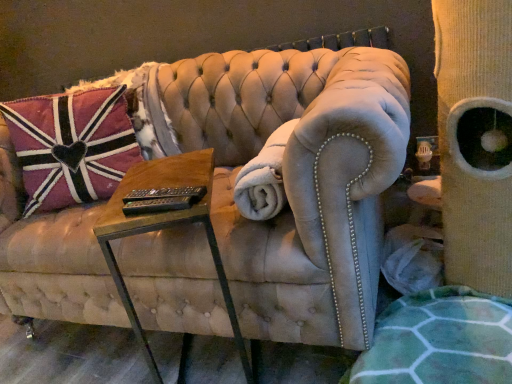
Question: Is white plush blanket at center to the left of woodenmaterial/texturetable at center from the viewer's perspective?

Choices:
 (A) yes
 (B) no

Answer: (B)

Question: Is white plush blanket at center wider than woodenmaterial/texturetable at center?

Choices:
 (A) no
 (B) yes

Answer: (A)

Question: Is woodenmaterial/texturetable at center surrounded by white plush blanket at center?

Choices:
 (A) yes
 (B) no

Answer: (B)

Question: Is white plush blanket at center to the right of woodenmaterial/texturetable at center from the viewer's perspective?

Choices:
 (A) yes
 (B) no

Answer: (A)

Question: From the image's perspective, is white plush blanket at center under woodenmaterial/texturetable at center?

Choices:
 (A) no
 (B) yes

Answer: (A)

Question: Can you confirm if white plush blanket at center is bigger than woodenmaterial/texturetable at center?

Choices:
 (A) yes
 (B) no

Answer: (B)

Question: Is pink velvet pillow at left to the left of beige corduroy cat tree at right from the viewer's perspective?

Choices:
 (A) no
 (B) yes

Answer: (B)

Question: Is pink velvet pillow at left touching beige corduroy cat tree at right?

Choices:
 (A) no
 (B) yes

Answer: (A)

Question: Is pink velvet pillow at left to the right of beige corduroy cat tree at right from the viewer's perspective?

Choices:
 (A) no
 (B) yes

Answer: (A)

Question: Can you confirm if pink velvet pillow at left is taller than beige corduroy cat tree at right?

Choices:
 (A) no
 (B) yes

Answer: (A)

Question: Would you say pink velvet pillow at left contains beige corduroy cat tree at right?

Choices:
 (A) no
 (B) yes

Answer: (A)

Question: From the image's perspective, is pink velvet pillow at left on beige corduroy cat tree at right?

Choices:
 (A) yes
 (B) no

Answer: (A)

Question: Is suede couch at center at the back of pink velvet pillow at left?

Choices:
 (A) no
 (B) yes

Answer: (B)